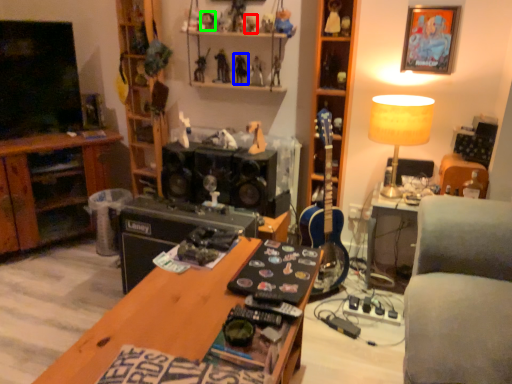
Question: Based on their relative distances, which object is farther from toy (highlighted by a red box)? Choose from toy (highlighted by a blue box) and toy (highlighted by a green box).

Choices:
 (A) toy
 (B) toy

Answer: (B)